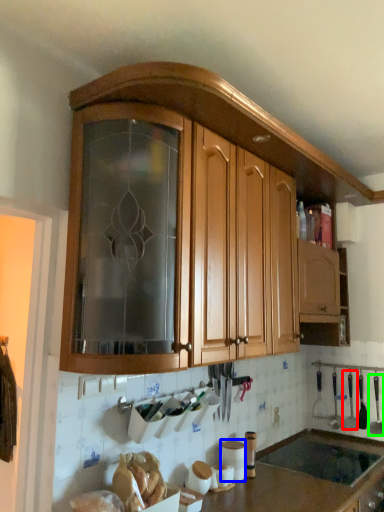
Question: Which is farther away from silverware (highlighted by a red box)? appliance (highlighted by a blue box) or silverware (highlighted by a green box)?

Choices:
 (A) appliance
 (B) silverware

Answer: (A)